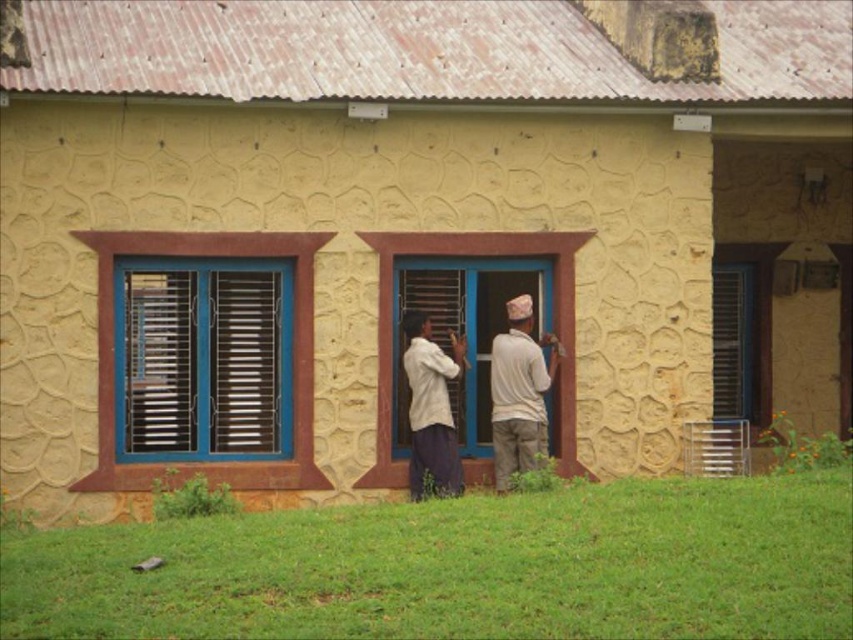
Who is shorter, light beige fabric shirt at center or matte wood shutter at center?

matte wood shutter at center

Measure the distance between point (537, 348) and camera.

Point (537, 348) and camera are 45.69 feet apart from each other.

The height and width of the screenshot is (640, 853). I want to click on light beige fabric shirt at center, so click(x=519, y=392).

Locate an element on the screen. blue metallic window at center is located at coordinates (202, 358).

Identify the location of blue metallic window at center. Image resolution: width=853 pixels, height=640 pixels. (202, 358).

Who is lower down, light beige fabric shirt at center or white cotton shirt at center?

white cotton shirt at center is below.

Between light beige fabric shirt at center and white cotton shirt at center, which one is positioned higher?

Positioned higher is light beige fabric shirt at center.

Is point (425, 348) less distant than point (523, 400)?

Yes.

This screenshot has width=853, height=640. Find the location of `light beige fabric shirt at center`. light beige fabric shirt at center is located at coordinates (519, 392).